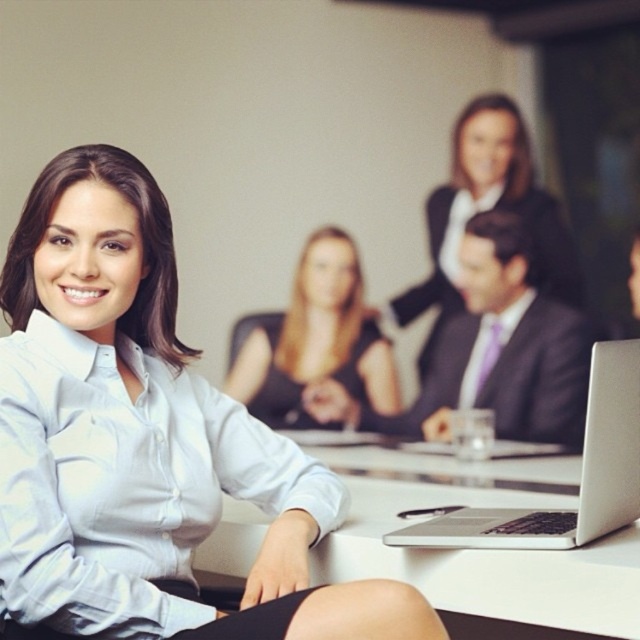
Between matte black suit at center and silver metallic laptop at center, which one is positioned lower?

Positioned lower is silver metallic laptop at center.

Who is higher up, matte black suit at center or silver metallic laptop at center?

matte black suit at center

Between point (540, 356) and point (600, 445), which one is positioned behind?

Positioned behind is point (540, 356).

Locate an element on the screen. This screenshot has height=640, width=640. matte black suit at center is located at coordinates (541, 376).

Can you confirm if white glossy table at center is shorter than purple satin business suit at center?

Indeed, white glossy table at center has a lesser height compared to purple satin business suit at center.

Which of these two, white glossy table at center or purple satin business suit at center, stands taller?

Standing taller between the two is purple satin business suit at center.

Where is `white glossy table at center`? The image size is (640, 640). white glossy table at center is located at coordinates (481, 548).

This screenshot has width=640, height=640. What are the coordinates of `white glossy table at center` in the screenshot? It's located at (481, 548).

Does white glossy table at center have a greater width compared to black glossy dress at center?

Yes.

Is white glossy table at center thinner than black glossy dress at center?

No, white glossy table at center is not thinner than black glossy dress at center.

Who is more forward, (x=257, y=522) or (x=310, y=320)?

Point (x=257, y=522) is in front.

Find the location of a particular element. The height and width of the screenshot is (640, 640). white glossy table at center is located at coordinates (481, 548).